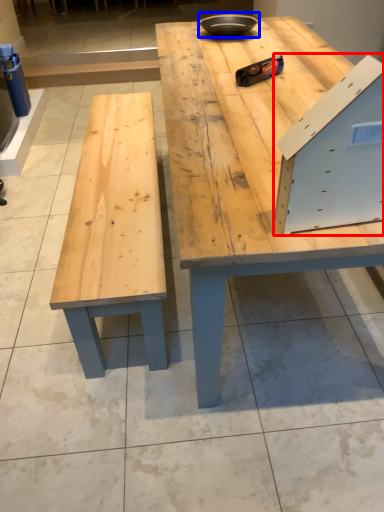
Question: Which object appears farthest to the camera in this image, drawer (highlighted by a red box) or bowl (highlighted by a blue box)?

Choices:
 (A) drawer
 (B) bowl

Answer: (B)